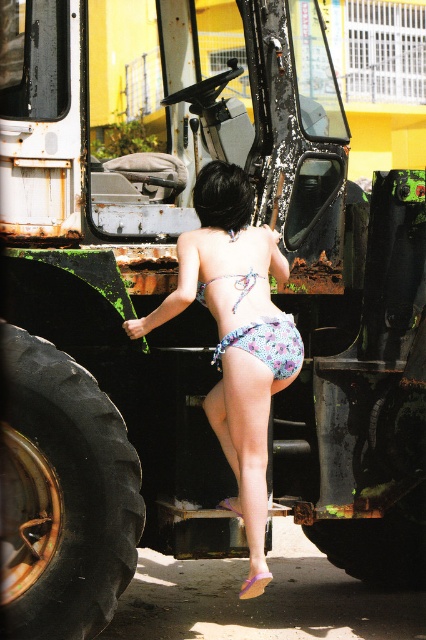
What is located at the coordinates point (236, 339) in the image?

The floral fabric bikini at center is located at point (236, 339).

You are a photographer trying to capture the floral fabric bikini at center and the floral print fabric bikini bottom at center in a single frame. Which one should you position your camera to the left of to ensure both are visible?

You should position your camera to the left of the floral print fabric bikini bottom at center because the floral fabric bikini at center is to the left of it, ensuring both are within the frame.

You are an observer looking at the image of a person wearing a floral fabric bikini at center and a floral print fabric bikini bottom at center. Which part of the clothing is located above the other?

The floral print fabric bikini bottom at center is above the floral fabric bikini at center because the bikini bottom is positioned over it.